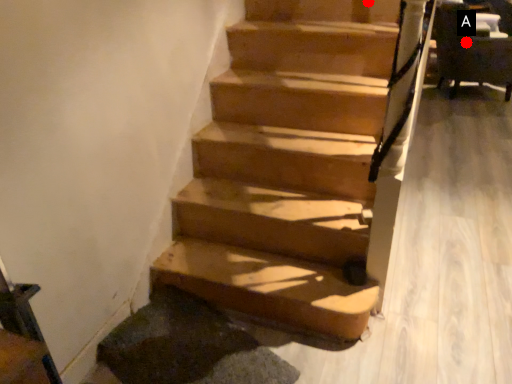
Question: Two points are circled on the image, labeled by A and B beside each circle. Among these points, which one is nearest to the camera?

Choices:
 (A) A is closer
 (B) B is closer

Answer: (B)